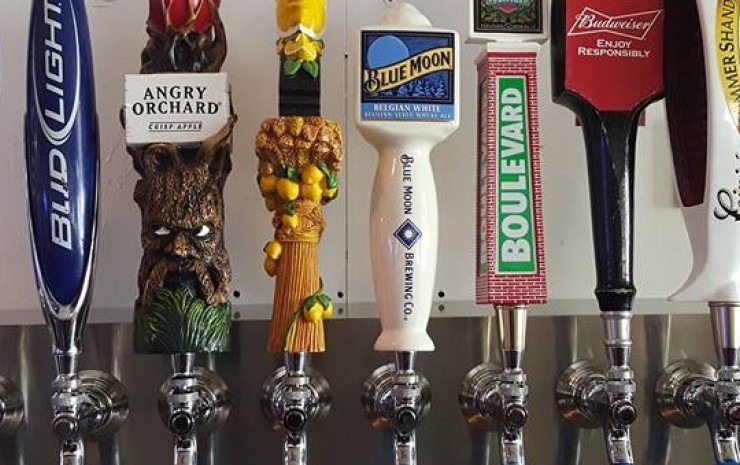
You are a GUI agent. You are given a task and a screenshot of the screen. Output one action in this format:
    pyautogui.click(x=<x>, y=<y>)
    Task: Click on the beer tap
    This screenshot has height=465, width=740.
    Given the screenshot: What is the action you would take?
    tap(715, 88), tap(622, 60), tap(504, 162), tap(411, 84), tap(289, 187), tap(185, 105), tap(52, 137)